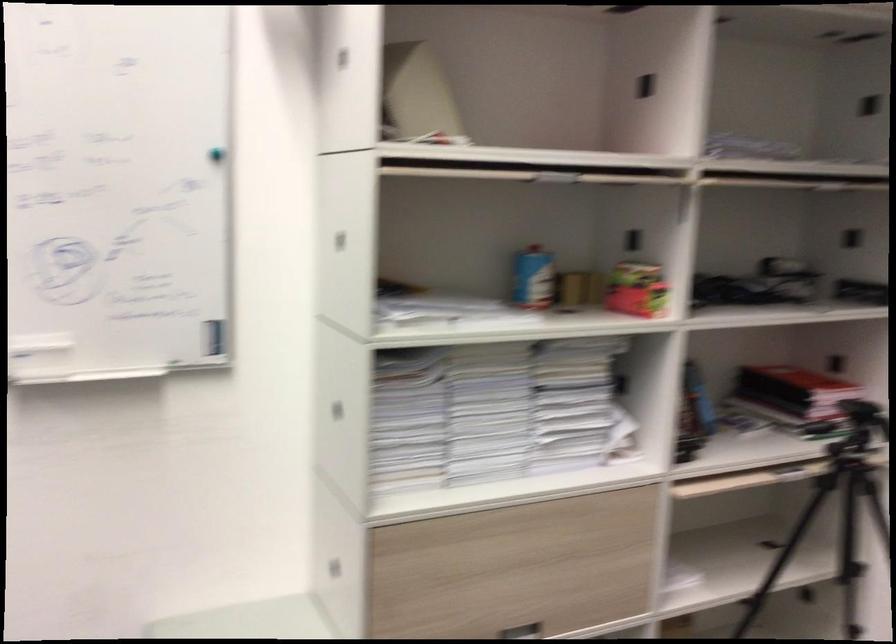
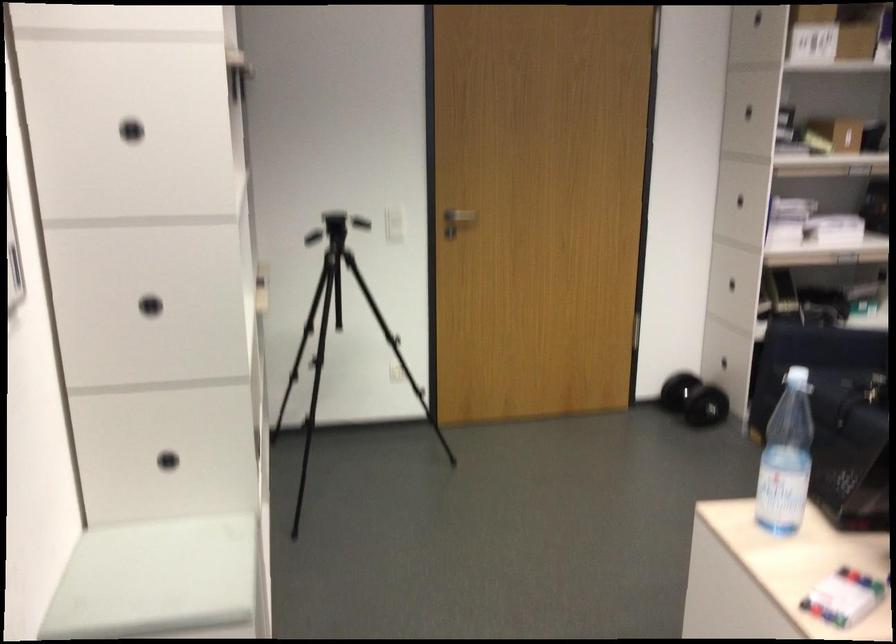
Question: I am providing you with two images of the same scene from different viewpoints. Please identify which objects are invisible in image2.

Choices:
 (A) black cabinet handle
 (B) stack of paper
 (C) metal door knob
 (D) black camera tripod

Answer: (B)